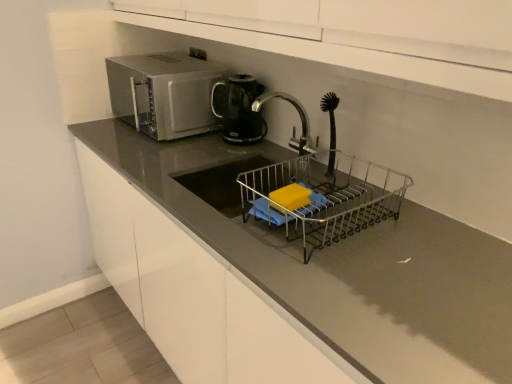
Identify the location of free spot in front of yellow sponge at sink. Image resolution: width=512 pixels, height=384 pixels. (302, 258).